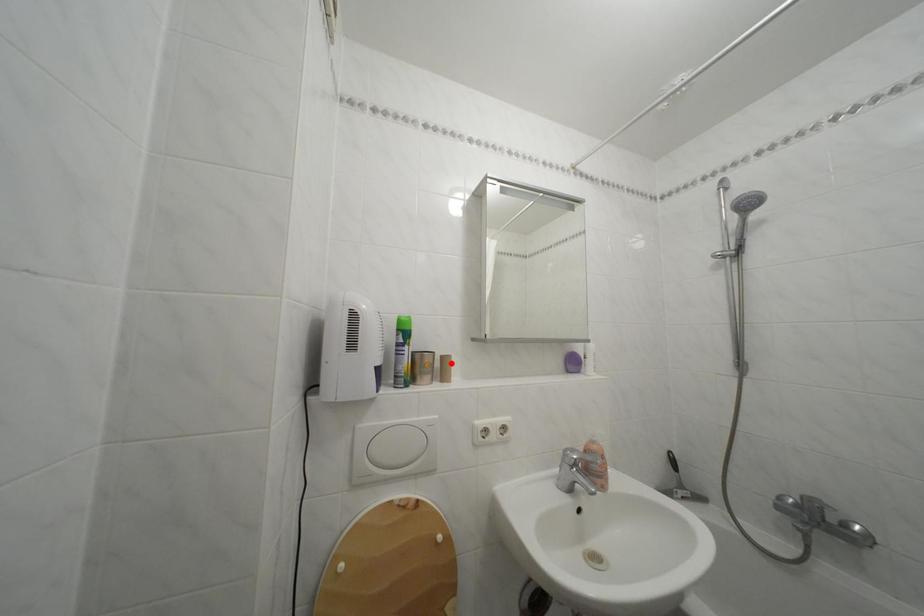
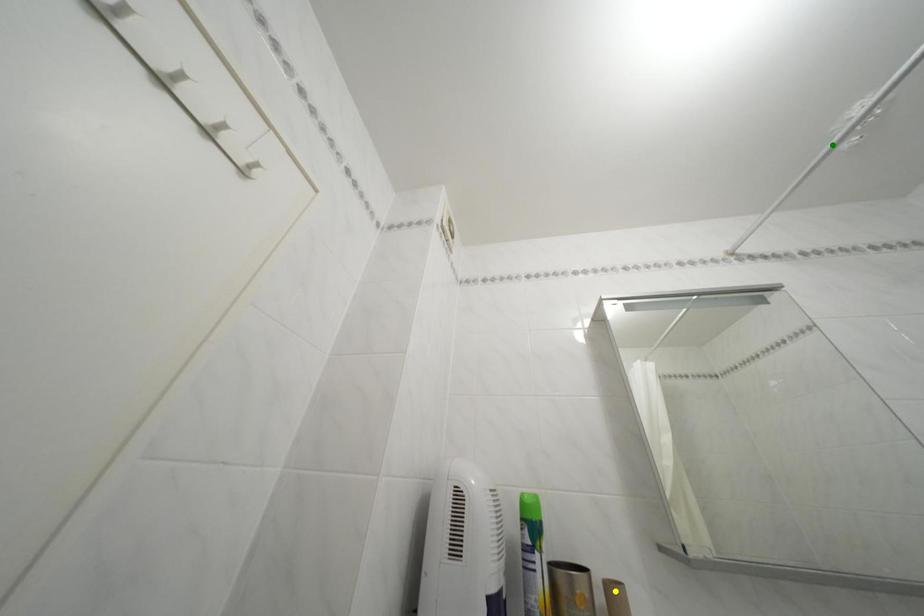
Question: I am providing you with two images of the same scene from different viewpoints. A red point is marked on the first image. You are given multiple points on the second image. Which point in image 2 is actually the same real-world point as the red point in image 1?

Choices:
 (A) yellow point
 (B) blue point
 (C) green point

Answer: (A)